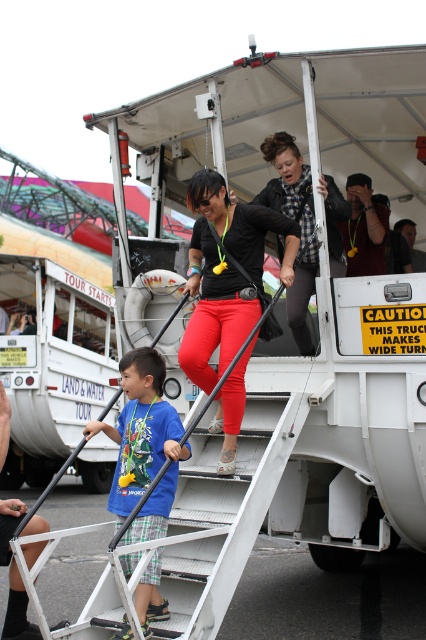
Question: Considering the real-world distances, which object is closest to the metallic gray stairs at center?

Choices:
 (A) blue cotton shirt at center
 (B) plaid fabric shirt at upper center
 (C) matte black shirt at center

Answer: (A)

Question: Which point is farther to the camera?

Choices:
 (A) matte black shirt at center
 (B) blue cotton shirt at center
 (C) plaid fabric shirt at upper center

Answer: (C)

Question: Does metallic gray stairs at center lie behind matte black shirt at center?

Choices:
 (A) yes
 (B) no

Answer: (B)

Question: Does metallic gray stairs at center appear under blue cotton shirt at center?

Choices:
 (A) yes
 (B) no

Answer: (A)

Question: Is metallic gray stairs at center further to the viewer compared to blue cotton shirt at center?

Choices:
 (A) yes
 (B) no

Answer: (B)

Question: Which object is the closest to the metallic gray stairs at center?

Choices:
 (A) blue cotton shirt at center
 (B) plaid fabric shirt at upper center
 (C) matte black shirt at center

Answer: (A)